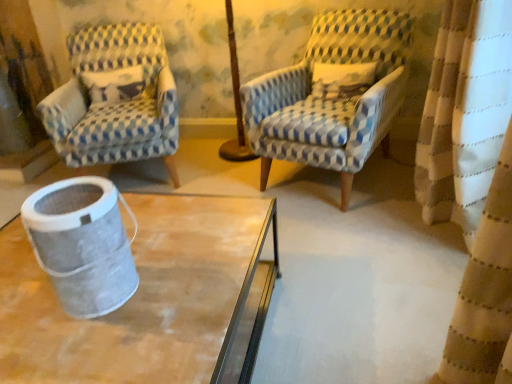
The width and height of the screenshot is (512, 384). What are the coordinates of `free space in front of blue and white checkered fabric armchair at center, arranged as the first chair when viewed from the right` in the screenshot? It's located at (339, 245).